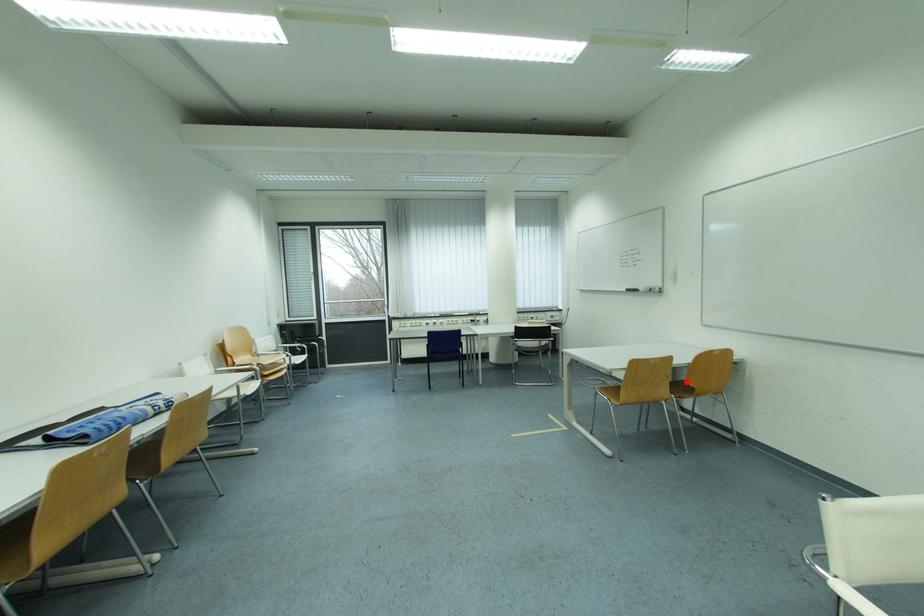
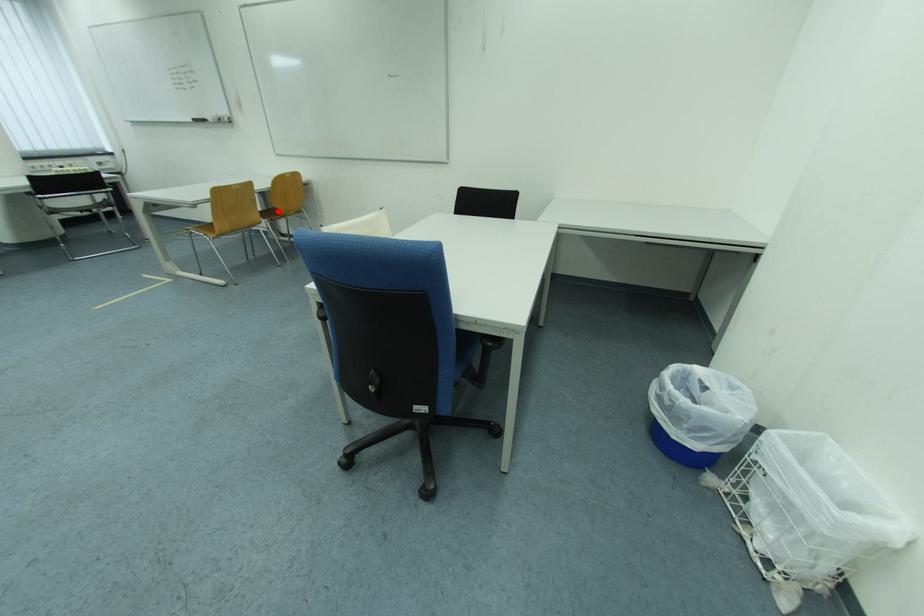
I am providing you with two images of the same scene from different viewpoints. A red point is marked on the first image and another point is marked on the second image. Does the point marked in image1 correspond to the same location as the one in image2?

Yes